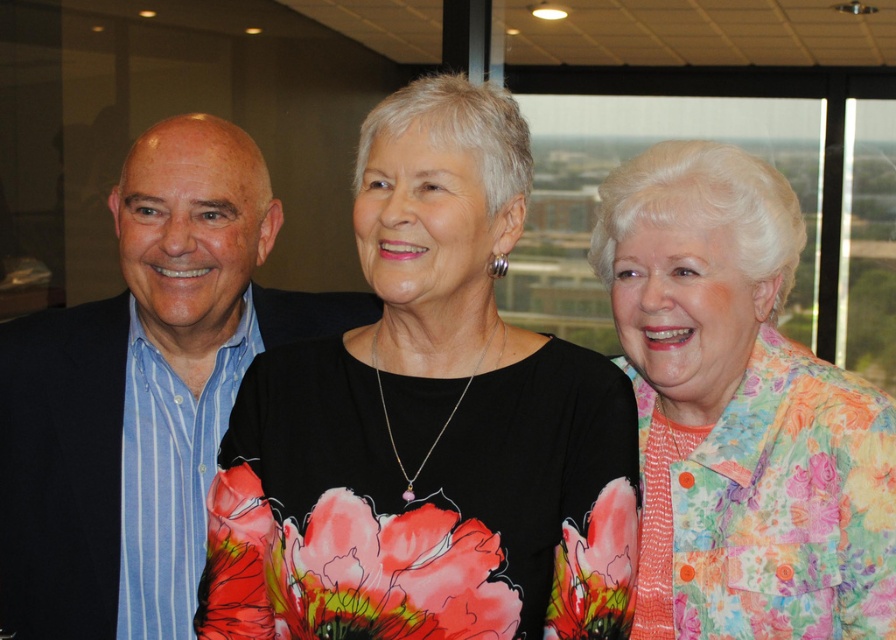
Question: Does black matte dress at center appear over floral-patterned shirt at center?

Choices:
 (A) no
 (B) yes

Answer: (A)

Question: Which of these objects is positioned closest to the floral-patterned shirt at center?

Choices:
 (A) black matte dress at center
 (B) blue striped shirt at left

Answer: (A)

Question: Considering the real-world distances, which object is farthest from the black matte dress at center?

Choices:
 (A) floral-patterned shirt at center
 (B) blue striped shirt at left

Answer: (B)

Question: Which of the following is the farthest from the observer?

Choices:
 (A) (173, 592)
 (B) (679, 193)
 (C) (565, 577)

Answer: (A)

Question: Is floral-patterned shirt at center smaller than blue striped shirt at left?

Choices:
 (A) no
 (B) yes

Answer: (B)

Question: Does black matte dress at center have a greater width compared to floral-patterned shirt at center?

Choices:
 (A) yes
 (B) no

Answer: (A)